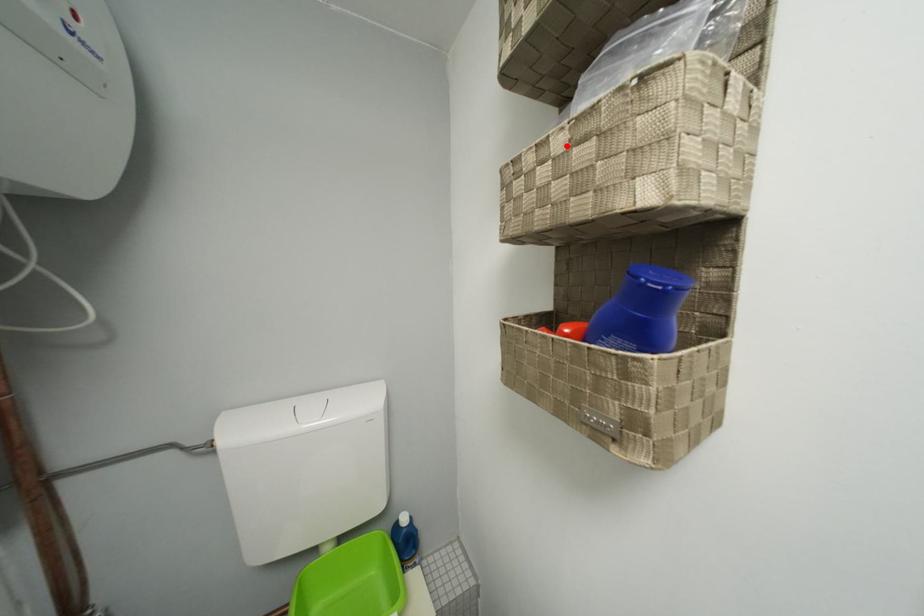
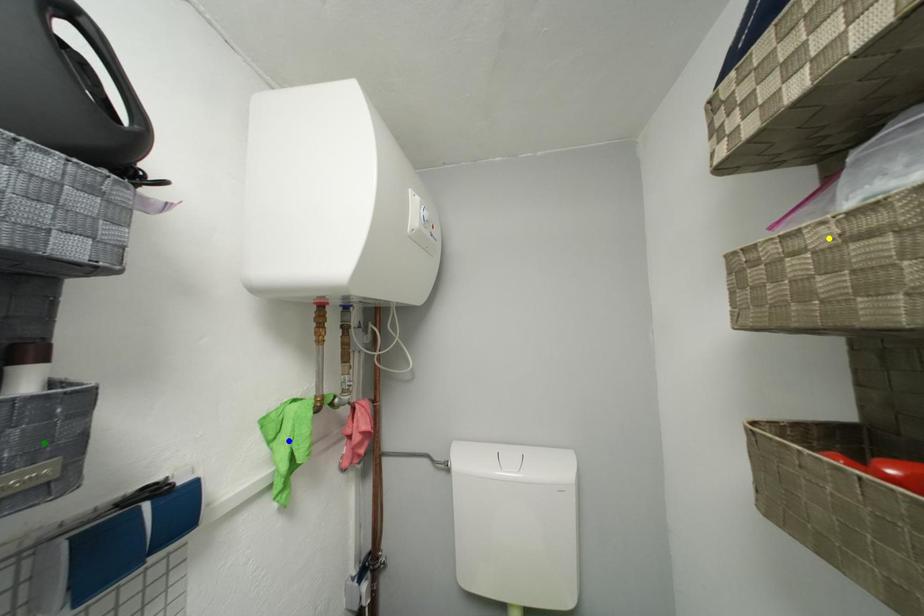
Question: I am providing you with two images of the same scene from different viewpoints. A red point is marked on the first image. You are given multiple points on the second image. Can you choose the point in image 2 that corresponds to the point in image 1?

Choices:
 (A) green point
 (B) yellow point
 (C) blue point

Answer: (B)